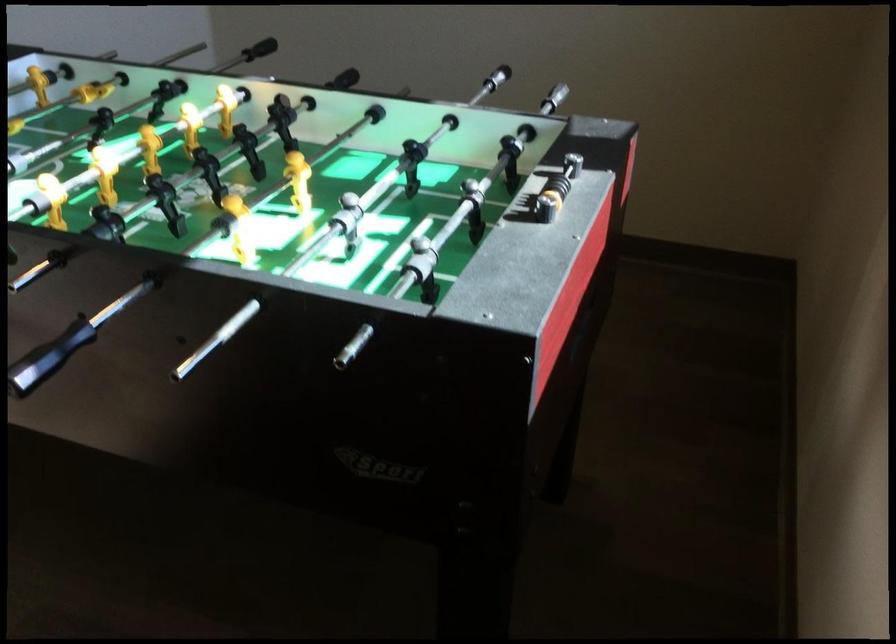
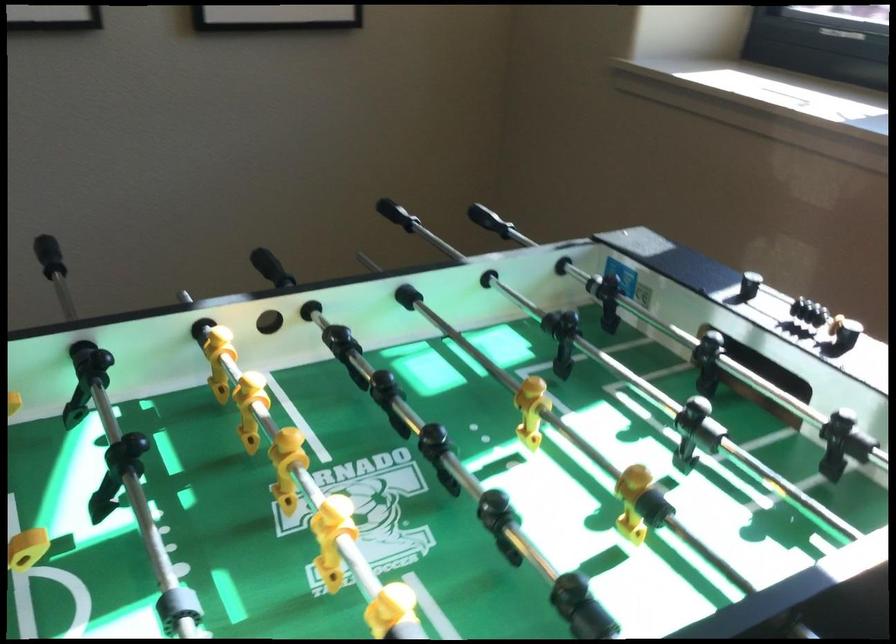
Locate, in the second image, the point that corresponds to pixel 409 86 in the first image.

(48, 256)